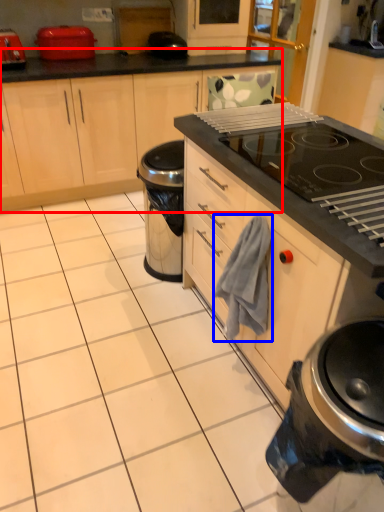
Question: Which object is closer to the camera taking this photo, cabinetry (highlighted by a red box) or hand towel (highlighted by a blue box)?

Choices:
 (A) cabinetry
 (B) hand towel

Answer: (B)